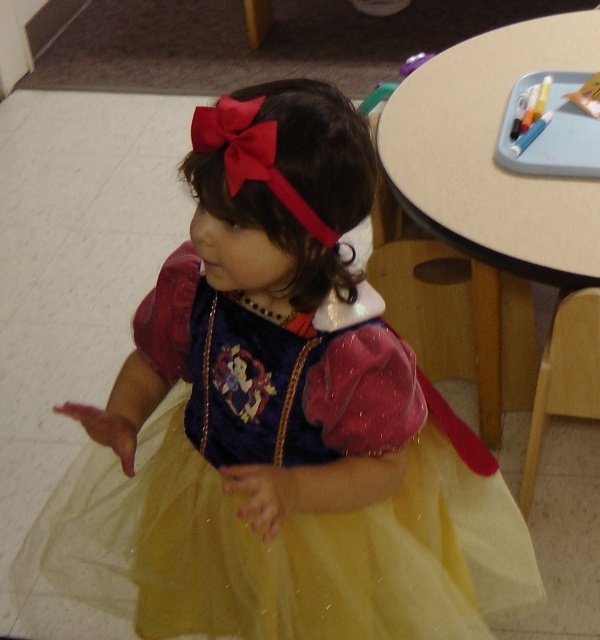
Question: Does yellow tulle dress at center appear on the right side of beige laminate table at upper right?

Choices:
 (A) yes
 (B) no

Answer: (B)

Question: Is yellow tulle dress at center above beige laminate table at upper right?

Choices:
 (A) yes
 (B) no

Answer: (B)

Question: Which point is closer to the camera?

Choices:
 (A) (498, 33)
 (B) (201, 340)

Answer: (B)

Question: Can you confirm if yellow tulle dress at center is positioned below beige laminate table at upper right?

Choices:
 (A) no
 (B) yes

Answer: (B)

Question: Which point is farther to the camera?

Choices:
 (A) (463, 156)
 (B) (135, 582)

Answer: (A)